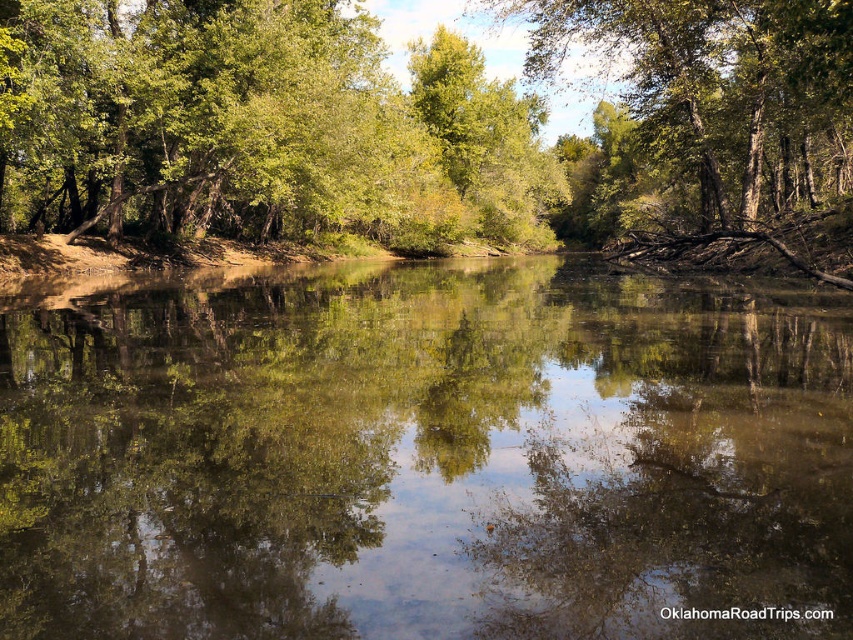
Question: Observing the image, what is the correct spatial positioning of clear water at center in reference to green leafy tree at upper center?

Choices:
 (A) above
 (B) below

Answer: (B)

Question: Is green leafy tree at center positioned before green leafy tree at upper center?

Choices:
 (A) no
 (B) yes

Answer: (B)

Question: Which of the following is the closest to the observer?

Choices:
 (A) green leafy tree at upper center
 (B) clear water at center
 (C) green leafy tree at center

Answer: (B)

Question: In this image, where is clear water at center located relative to green leafy tree at upper center?

Choices:
 (A) below
 (B) above

Answer: (A)

Question: Which object is closer to the camera taking this photo?

Choices:
 (A) green leafy tree at center
 (B) clear water at center

Answer: (B)

Question: Which is farther from the green leafy tree at upper center?

Choices:
 (A) clear water at center
 (B) green leafy tree at center

Answer: (A)